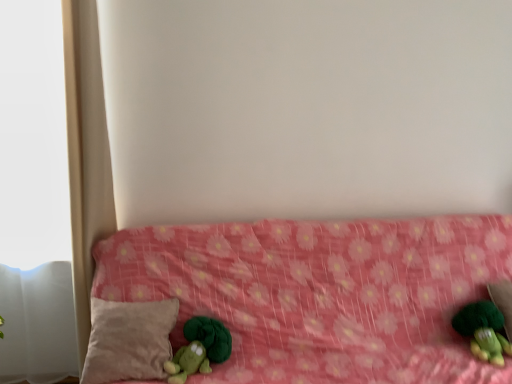
Question: From the image's perspective, is beige soft pillow at lower left located above or below green plush toy at lower left, placed as the 2th toy when sorted from right to left?

Choices:
 (A) above
 (B) below

Answer: (A)

Question: Is point (133, 302) positioned closer to the camera than point (189, 372)?

Choices:
 (A) closer
 (B) farther

Answer: (B)

Question: Which object is the farthest from the beige soft pillow at lower left?

Choices:
 (A) green plush toy at lower left, placed as the 2th toy when sorted from right to left
 (B) pink fabric bed at center
 (C) green plush toy at lower right, positioned as the first toy in right-to-left order

Answer: (C)

Question: Which object is positioned closest to the green plush toy at lower left, positioned as the first toy in left-to-right order?

Choices:
 (A) pink fabric bed at center
 (B) beige soft pillow at lower left
 (C) green plush toy at lower right, positioned as the first toy in right-to-left order

Answer: (B)